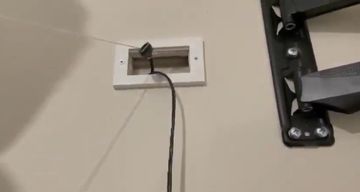
Locate an element on the screen. white frame is located at coordinates (191, 79).